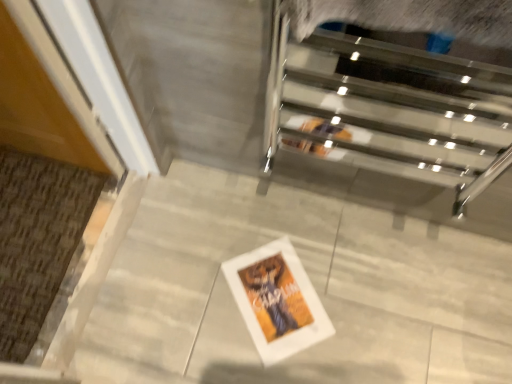
Locate an element on the screen. Image resolution: width=512 pixels, height=384 pixels. vacant space that is to the left of white matte picture frame at center is located at coordinates (189, 297).